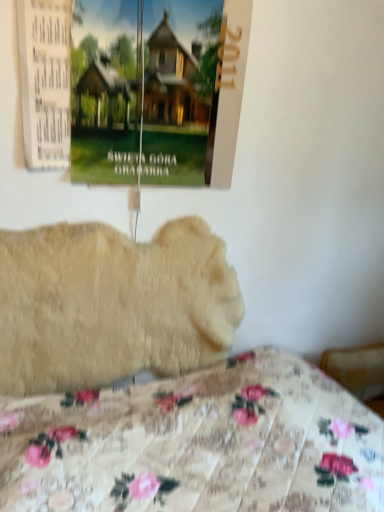
Question: Considering the positions of matte paper poster at upper left and floral fabric bed at lower center in the image, is matte paper poster at upper left wider or thinner than floral fabric bed at lower center?

Choices:
 (A) wide
 (B) thin

Answer: (B)

Question: Is point (92, 174) positioned closer to the camera than point (41, 473)?

Choices:
 (A) farther
 (B) closer

Answer: (A)

Question: Which object is the closest to the fluffy beige dog at center?

Choices:
 (A) floral fabric bed at lower center
 (B) matte paper poster at upper left

Answer: (A)

Question: Which is farther from the fluffy beige dog at center?

Choices:
 (A) matte paper poster at upper left
 (B) floral fabric bed at lower center

Answer: (A)